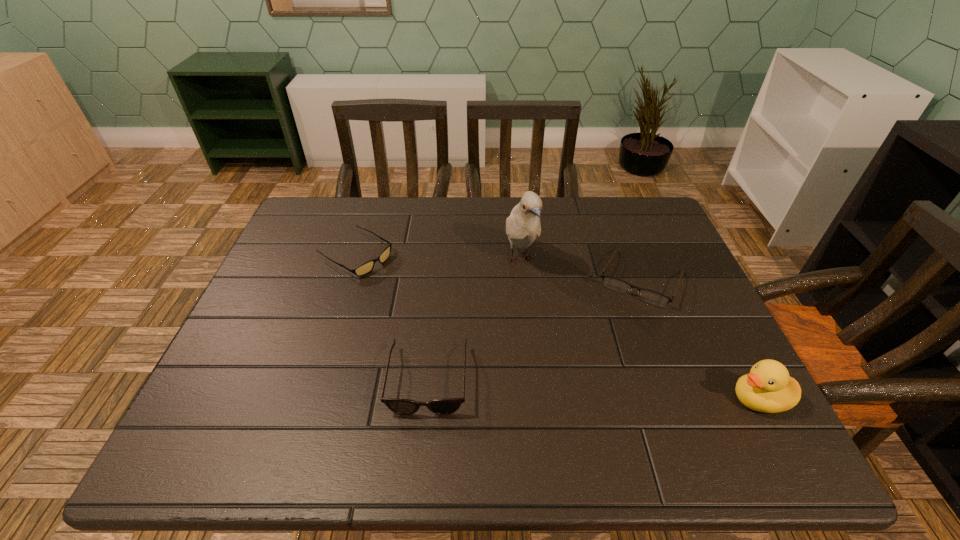
Locate an element on the screen. The height and width of the screenshot is (540, 960). vacant space located 0.060m on the face of the duckling is located at coordinates (700, 399).

Where is `vacant area situated at the beak of the bird`? vacant area situated at the beak of the bird is located at coordinates (564, 361).

The width and height of the screenshot is (960, 540). I want to click on free space located 0.270m at the beak of the bird, so click(x=566, y=368).

Locate an element on the screen. Image resolution: width=960 pixels, height=540 pixels. free space located 0.380m at the beak of the bird is located at coordinates (588, 412).

Locate an element on the screen. This screenshot has width=960, height=540. free space located on the front-facing side of the left sunglasses is located at coordinates (475, 325).

Where is `free location located 0.330m on the front-facing side of the left sunglasses`? free location located 0.330m on the front-facing side of the left sunglasses is located at coordinates (479, 327).

You are a GUI agent. You are given a task and a screenshot of the screen. Output one action in this format:
    pyautogui.click(x=<x>, y=<y>)
    Task: Click on the vacant point located 0.100m on the front-facing side of the left sunglasses
    The height and width of the screenshot is (540, 960).
    Given the screenshot: What is the action you would take?
    pyautogui.click(x=408, y=286)

This screenshot has width=960, height=540. What are the coordinates of `vacant space situated on the front-facing side of the spectacles` in the screenshot? It's located at (582, 407).

At what (x,y) coordinates should I click in order to perform the action: click on vacant space located 0.320m on the front-facing side of the spectacles. Please return your answer as a coordinate pair (x, y). Looking at the image, I should click on (582, 407).

The image size is (960, 540). What are the coordinates of `free space located on the front-facing side of the spectacles` in the screenshot? It's located at (609, 348).